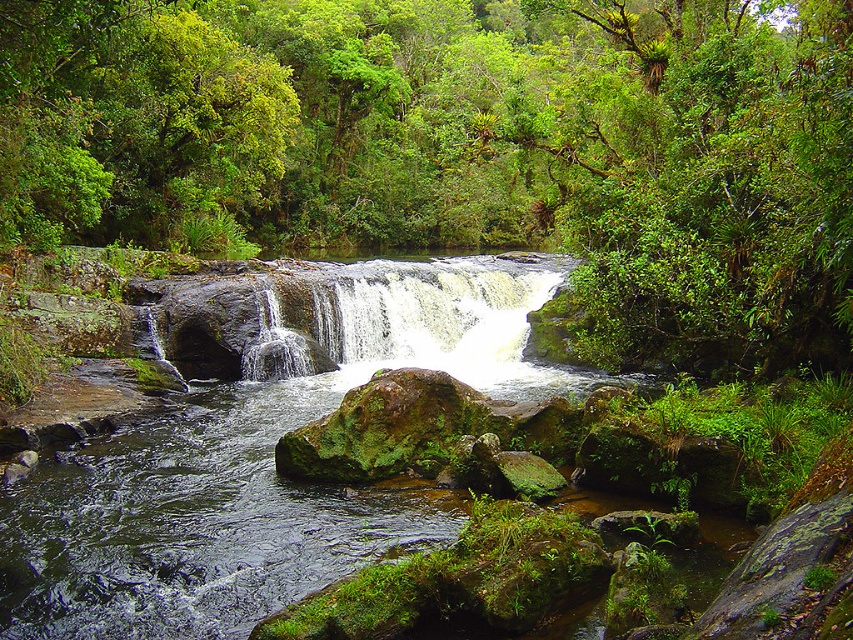
Consider the image. You are a hiker standing at the edge of the forest. You see a green leafy tree at center and a white frothy water at center in the distance. You want to place a 10 meter long rope between them to create a zip line. Is the rope long enough to connect them?

The distance between the green leafy tree at center and the white frothy water at center is 13.72 meters. Since the rope is only 10 meters long, it is not long enough to span the distance between them.

You are standing in the forest and see the green leafy tree at center and the white frothy water at center. Which one has a larger width from your perspective?

The green leafy tree at center might be wider than white frothy water at center according to the description.

You are a hiker standing at the base of the waterfall. You notice a green leafy tree at upper center and white frothy water at center. Which object is positioned to the right side from your viewpoint?

The green leafy tree at upper center is positioned to the right of the white frothy water at center.